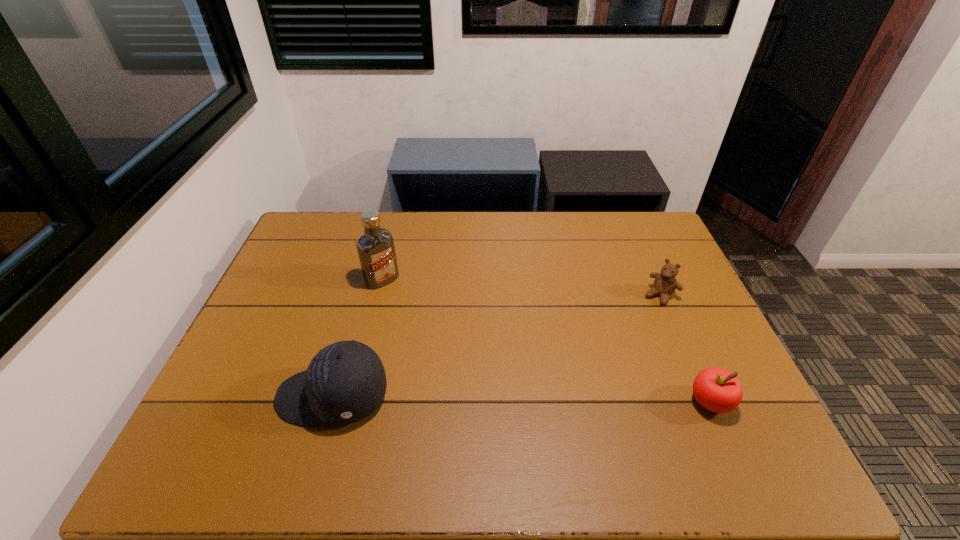
Identify the location of object that is positioned at the near right corner. pyautogui.click(x=716, y=389).

Where is `blank space at the far edge`? This screenshot has height=540, width=960. blank space at the far edge is located at coordinates (492, 215).

Where is `free space at the near edge`? free space at the near edge is located at coordinates (595, 421).

Locate an element on the screen. vacant position at the left edge of the desktop is located at coordinates (311, 293).

Find the location of a particular element. The image size is (960, 540). vacant space at the right edge is located at coordinates (683, 329).

The image size is (960, 540). In order to click on vacant space at the far left corner in this screenshot , I will do `click(331, 220)`.

In the image, there is a desktop. Identify the location of vacant space at the near left corner. (234, 411).

Find the location of a particular element. The width and height of the screenshot is (960, 540). vacant area at the far right corner of the desktop is located at coordinates (652, 214).

Where is `blank region between the baseball cap and the teddy bear`? blank region between the baseball cap and the teddy bear is located at coordinates (x=496, y=346).

Identify the location of empty space between the teddy bear and the apple. (684, 349).